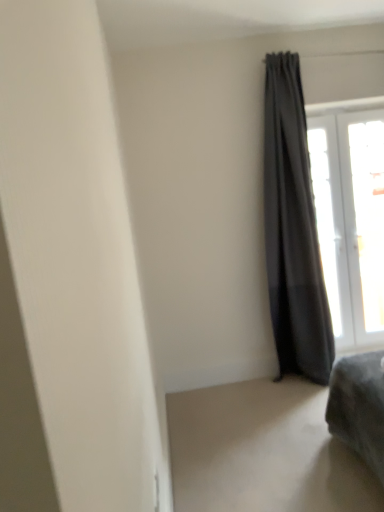
Question: Considering the relative sizes of dark gray fabric curtain at right and transparent glass window at upper right, the first window when ordered from right to left, in the image provided, is dark gray fabric curtain at right taller than transparent glass window at upper right, the first window when ordered from right to left,?

Choices:
 (A) yes
 (B) no

Answer: (A)

Question: From a real-world perspective, is dark gray fabric curtain at right located beneath transparent glass window at upper right, which ranks as the 2th window in left-to-right order?

Choices:
 (A) yes
 (B) no

Answer: (B)

Question: Can you confirm if dark gray fabric curtain at right is shorter than transparent glass window at upper right, the first window when ordered from right to left?

Choices:
 (A) no
 (B) yes

Answer: (A)

Question: Is dark gray fabric curtain at right closer to camera compared to transparent glass window at upper right, which ranks as the 2th window in left-to-right order?

Choices:
 (A) yes
 (B) no

Answer: (A)

Question: Can you confirm if dark gray fabric curtain at right is smaller than transparent glass window at upper right, which ranks as the 2th window in left-to-right order?

Choices:
 (A) yes
 (B) no

Answer: (B)

Question: Is point (372, 436) positioned closer to the camera than point (268, 223)?

Choices:
 (A) closer
 (B) farther

Answer: (A)

Question: Is velvet gray ottoman at lower right in front of or behind dark gray fabric curtain at right in the image?

Choices:
 (A) front
 (B) behind

Answer: (A)

Question: Is velvet gray ottoman at lower right bigger or smaller than dark gray fabric curtain at right?

Choices:
 (A) small
 (B) big

Answer: (A)

Question: Is velvet gray ottoman at lower right inside or outside of dark gray fabric curtain at right?

Choices:
 (A) inside
 (B) outside

Answer: (B)

Question: From a real-world perspective, is velvet gray ottoman at lower right above or below transparent glass window at upper right, the first window when ordered from right to left?

Choices:
 (A) above
 (B) below

Answer: (B)

Question: Would you say velvet gray ottoman at lower right is to the left or to the right of transparent glass window at upper right, the first window when ordered from right to left, in the picture?

Choices:
 (A) left
 (B) right

Answer: (A)

Question: Looking at the image, does velvet gray ottoman at lower right seem bigger or smaller compared to transparent glass window at upper right, the first window when ordered from right to left?

Choices:
 (A) small
 (B) big

Answer: (B)

Question: Is velvet gray ottoman at lower right wider or thinner than transparent glass window at upper right, the first window when ordered from right to left?

Choices:
 (A) wide
 (B) thin

Answer: (A)

Question: Relative to velvet gray ottoman at lower right, is dark gray fabric curtain at right in front or behind?

Choices:
 (A) behind
 (B) front

Answer: (A)

Question: From the image's perspective, is dark gray fabric curtain at right located above or below velvet gray ottoman at lower right?

Choices:
 (A) above
 (B) below

Answer: (A)